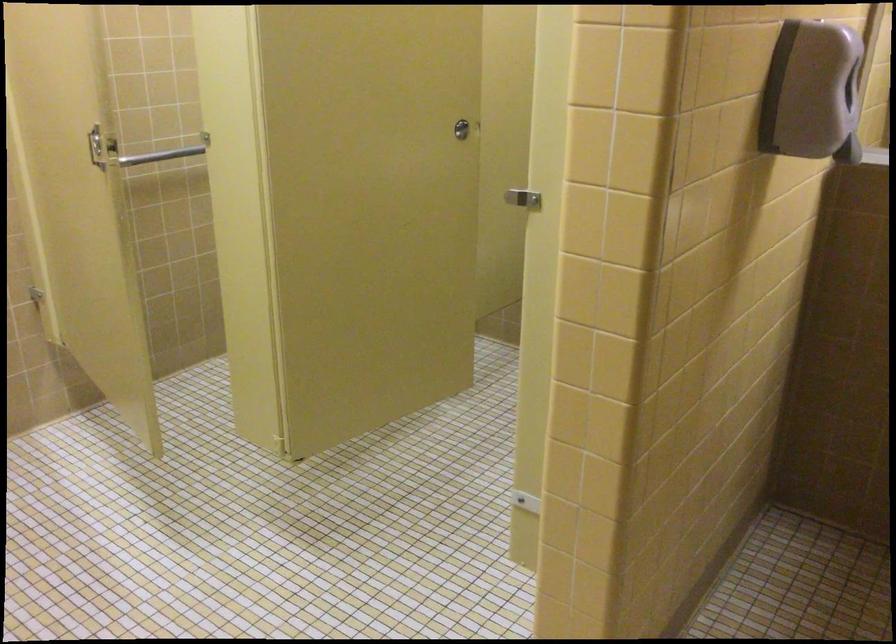
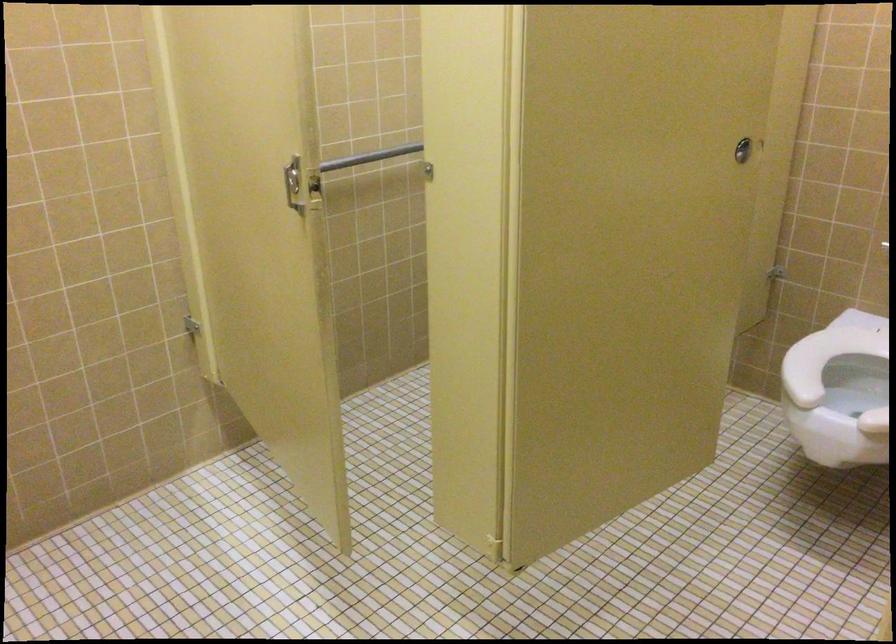
Question: The camera is either moving clockwise (left) or counter-clockwise (right) around the object. The first image is from the beginning of the video and the second image is from the end. Is the camera moving left or right when shooting the video?

Choices:
 (A) Left
 (B) Right

Answer: (B)